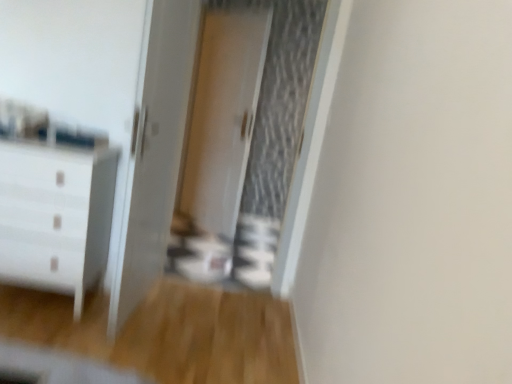
Question: Could you tell me if white glossy door at center is turned towards white glossy screen door at center, the second screen door when ordered from back to front?

Choices:
 (A) yes
 (B) no

Answer: (B)

Question: From the image's perspective, does white glossy door at center appear lower than white glossy screen door at center, the second screen door when ordered from back to front?

Choices:
 (A) yes
 (B) no

Answer: (A)

Question: Can you confirm if white glossy door at center is bigger than white glossy screen door at center, the first screen door in the front-to-back sequence?

Choices:
 (A) no
 (B) yes

Answer: (A)

Question: Is white glossy screen door at center, the first screen door in the front-to-back sequence, surrounded by white glossy door at center?

Choices:
 (A) yes
 (B) no

Answer: (B)

Question: Is white glossy door at center in contact with white glossy screen door at center, the second screen door when ordered from back to front?

Choices:
 (A) yes
 (B) no

Answer: (B)

Question: Is white glossy door at center smaller than white glossy screen door at center, the first screen door in the front-to-back sequence?

Choices:
 (A) no
 (B) yes

Answer: (B)

Question: Is white glossy door at center, the first screen door positioned from the back, bigger than white glossy chest of drawers at left?

Choices:
 (A) no
 (B) yes

Answer: (A)

Question: Can you confirm if white glossy door at center, the 2th screen door viewed from the front, is wider than white glossy chest of drawers at left?

Choices:
 (A) yes
 (B) no

Answer: (B)

Question: Is white glossy door at center, the 2th screen door viewed from the front, facing towards white glossy chest of drawers at left?

Choices:
 (A) yes
 (B) no

Answer: (A)

Question: Is white glossy door at center, the first screen door positioned from the back, positioned with its back to white glossy chest of drawers at left?

Choices:
 (A) yes
 (B) no

Answer: (B)

Question: Is white glossy door at center, the 2th screen door viewed from the front, at the left side of white glossy chest of drawers at left?

Choices:
 (A) no
 (B) yes

Answer: (A)

Question: Is white glossy door at center, the 2th screen door viewed from the front, positioned before white glossy chest of drawers at left?

Choices:
 (A) no
 (B) yes

Answer: (A)

Question: Is white glossy chest of drawers at left positioned with its back to white glossy door at center, the 2th screen door viewed from the front?

Choices:
 (A) yes
 (B) no

Answer: (A)